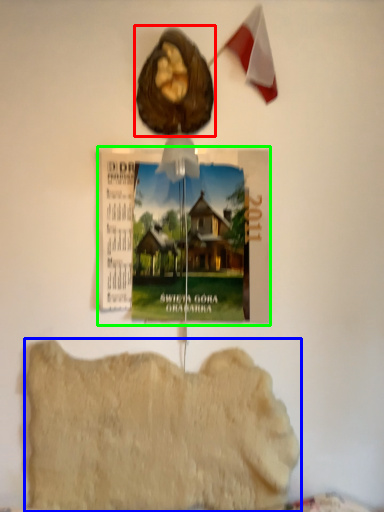
Question: Based on their relative distances, which object is nearer to animal (highlighted by a red box)? Choose from food (highlighted by a blue box) and postcard (highlighted by a green box).

Choices:
 (A) food
 (B) postcard

Answer: (B)